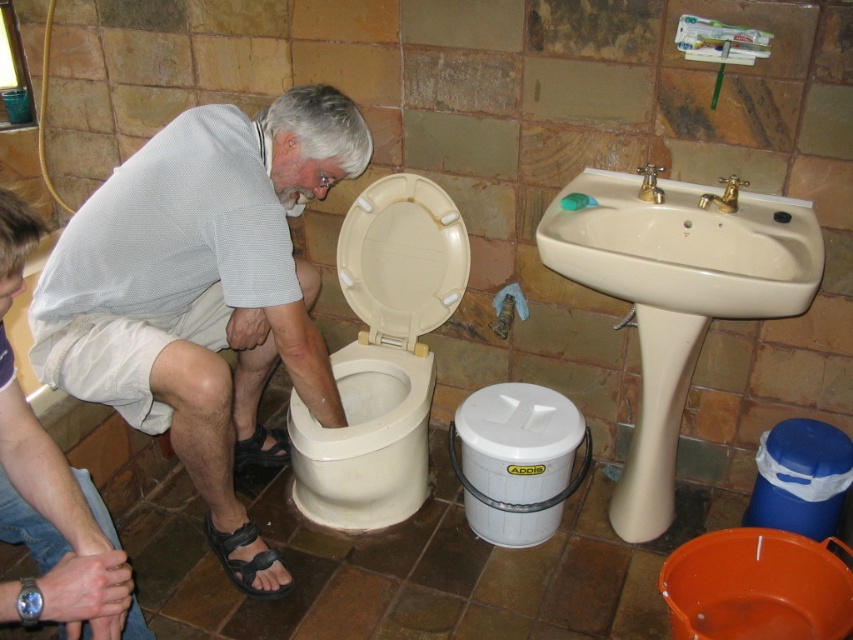
Who is shorter, black leather sandal at lower left or gold metallic faucet at upper right?

Standing shorter between the two is gold metallic faucet at upper right.

Locate an element on the screen. black leather sandal at lower left is located at coordinates (241, 560).

Between beige ceramic sink at upper center and gold metallic faucet at upper right, which one has less height?

Standing shorter between the two is gold metallic faucet at upper right.

Image resolution: width=853 pixels, height=640 pixels. I want to click on beige ceramic sink at upper center, so click(676, 298).

Locate an element on the screen. beige ceramic sink at upper center is located at coordinates (676, 298).

Between white glossy toilet bowl at center and beige plastic toilet seat at center, which one appears on the right side from the viewer's perspective?

beige plastic toilet seat at center

Is white glossy toilet bowl at center wider than beige plastic toilet seat at center?

Indeed, white glossy toilet bowl at center has a greater width compared to beige plastic toilet seat at center.

Does point (402, 408) come farther from viewer compared to point (440, 209)?

No.

I want to click on white glossy toilet bowl at center, so click(x=364, y=440).